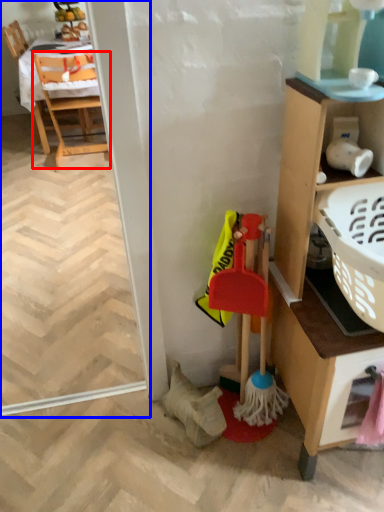
Question: Among these objects, which one is farthest to the camera, chair (highlighted by a red box) or screen door (highlighted by a blue box)?

Choices:
 (A) chair
 (B) screen door

Answer: (A)